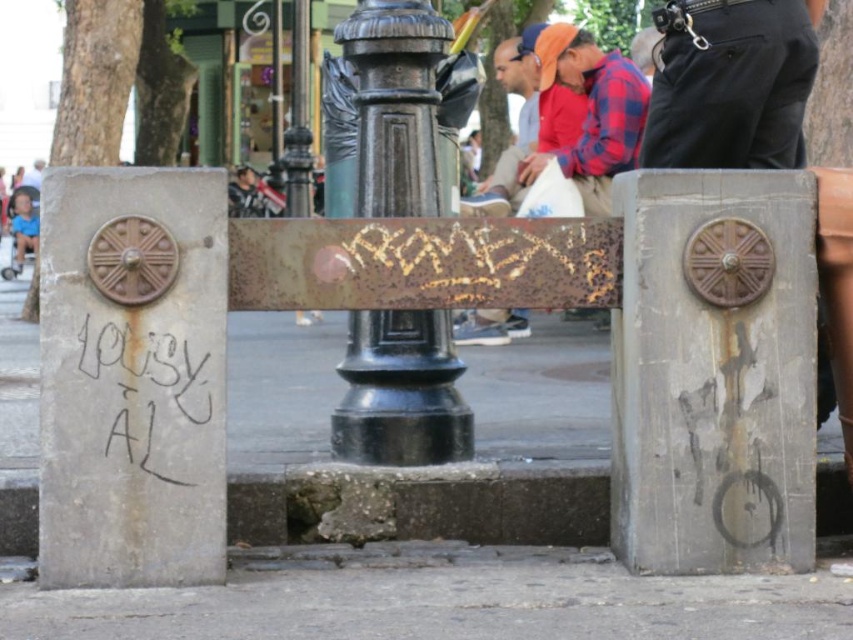
You are a person standing in the park. You see the gray concrete pavement at lower center and the blue denim shorts at left. Which object is taller?

The blue denim shorts at left are taller than the gray concrete pavement at lower center.

You are a delivery person trying to navigate through the space between the black polished metal pole at center and the concrete at lower left. Based on their positions, can you pass through that space?

The concrete at lower left is behind the black polished metal pole at center, so there is no space between them for you to pass through.

You are standing in a park and see the black polished metal pole at center. If you walk straight ahead, will you get closer to it or farther away from it?

The black polished metal pole at center is 7.38 meters from viewer. Walking straight ahead will bring you closer to it since you are moving towards the pole.